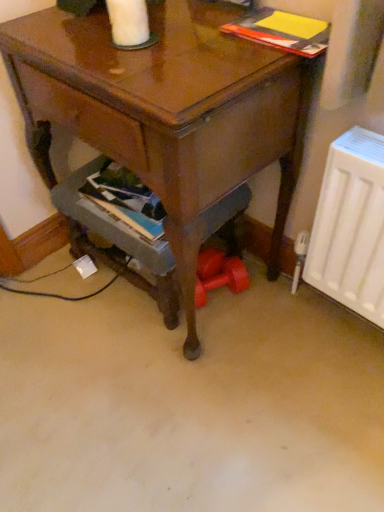
Locate an element on the screen. Image resolution: width=384 pixels, height=512 pixels. free space in front of shiny brown desk at center is located at coordinates (184, 406).